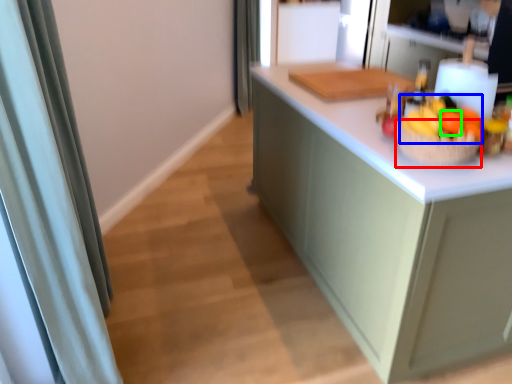
Question: Considering the real-world distances, which object is farthest from basket (highlighted by a red box)? fruit (highlighted by a blue box) or orange (highlighted by a green box)?

Choices:
 (A) fruit
 (B) orange

Answer: (B)